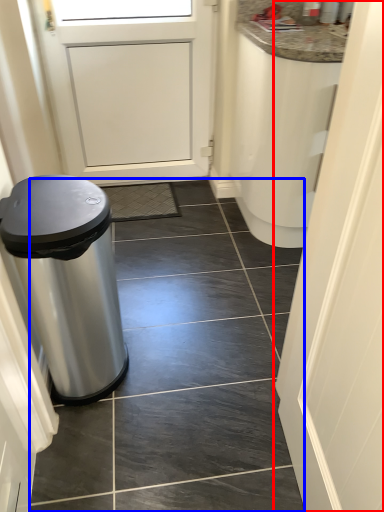
Question: Which object appears closest to the camera in this image, door (highlighted by a red box) or tile (highlighted by a blue box)?

Choices:
 (A) door
 (B) tile

Answer: (A)